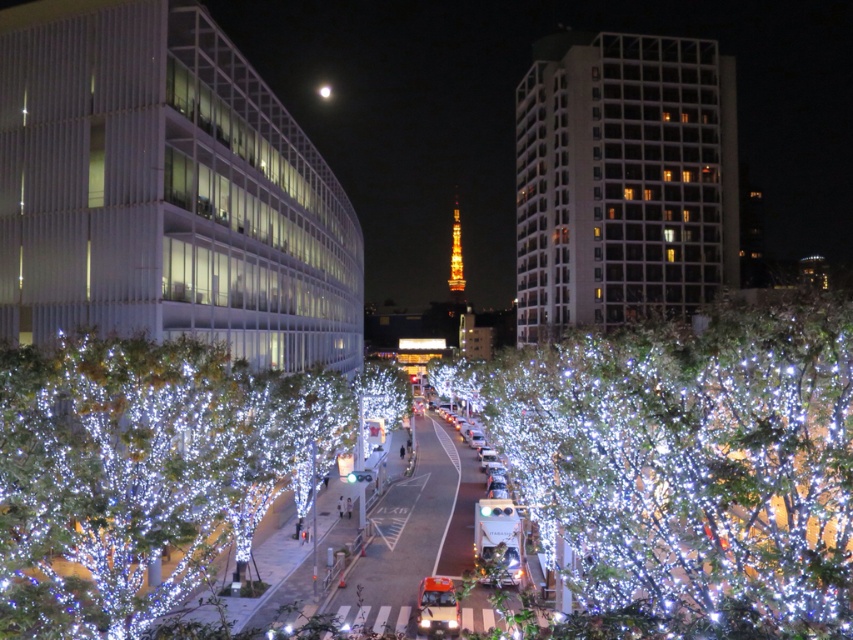
In the scene shown: Does illuminated plastic tree at center appear under illuminated plastic trees at center?

No.

Which of these two, illuminated plastic tree at center or illuminated plastic trees at center, stands shorter?

Standing shorter between the two is illuminated plastic trees at center.

Is point (714, 582) less distant than point (200, 381)?

Yes, it is in front of point (200, 381).

Identify the location of illuminated plastic tree at center. The width and height of the screenshot is (853, 640). tap(689, 465).